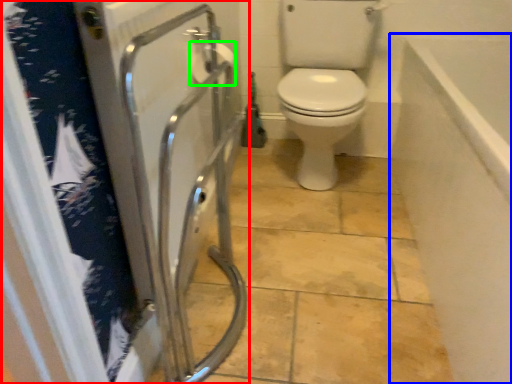
Question: Based on their relative distances, which object is farther from screen door (highlighted by a red box)? Choose from bath (highlighted by a blue box) and toilet paper (highlighted by a green box).

Choices:
 (A) bath
 (B) toilet paper

Answer: (A)